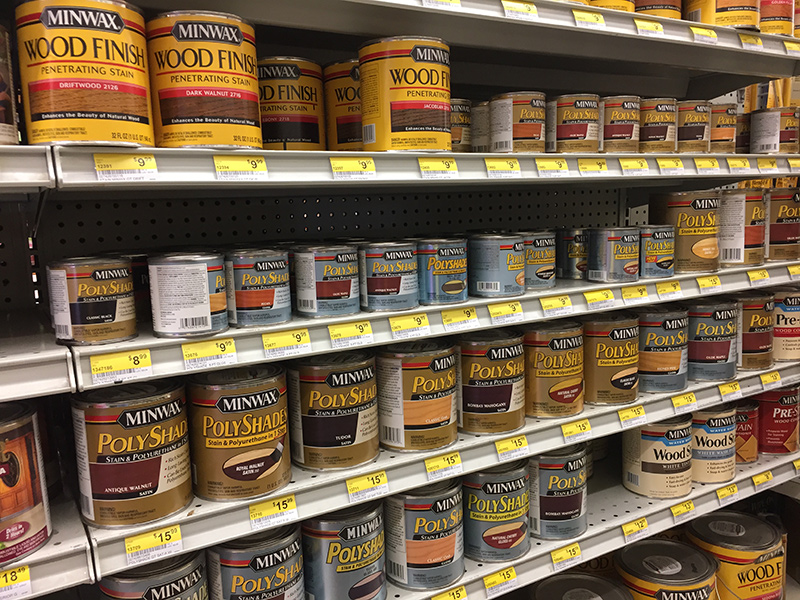
Find the location of `cans on second shelf`. cans on second shelf is located at coordinates (181, 580), (294, 560), (340, 551), (450, 532), (493, 513), (550, 484), (666, 466), (726, 444), (746, 438), (782, 409).